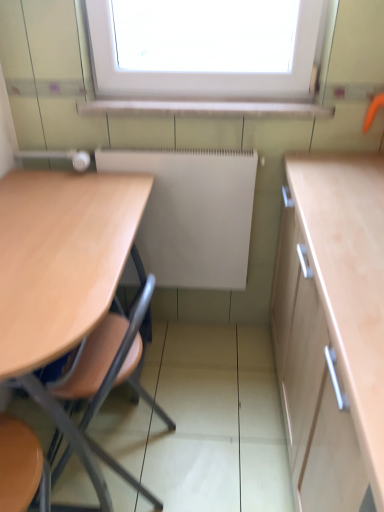
Question: From the image's perspective, would you say white matte radiator at center is positioned over light wood table at left?

Choices:
 (A) no
 (B) yes

Answer: (B)

Question: Is white matte radiator at center closer to camera compared to light wood table at left?

Choices:
 (A) yes
 (B) no

Answer: (B)

Question: Is white matte radiator at center positioned with its back to light wood table at left?

Choices:
 (A) no
 (B) yes

Answer: (A)

Question: Is white matte radiator at center next to light wood table at left and touching it?

Choices:
 (A) yes
 (B) no

Answer: (B)

Question: Is white matte radiator at center behind light wood table at left?

Choices:
 (A) no
 (B) yes

Answer: (B)

Question: Is white matte radiator at center taller than light wood table at left?

Choices:
 (A) no
 (B) yes

Answer: (A)

Question: From the image's perspective, is light wood table at left beneath white matte radiator at center?

Choices:
 (A) yes
 (B) no

Answer: (A)

Question: Is light wood table at left bigger than white matte radiator at center?

Choices:
 (A) yes
 (B) no

Answer: (A)

Question: Can you confirm if light wood table at left is wider than white matte radiator at center?

Choices:
 (A) yes
 (B) no

Answer: (A)

Question: Is light wood table at left thinner than white matte radiator at center?

Choices:
 (A) yes
 (B) no

Answer: (B)

Question: Would you say light wood table at left is outside white matte radiator at center?

Choices:
 (A) yes
 (B) no

Answer: (A)

Question: Is light wood table at left facing towards white matte radiator at center?

Choices:
 (A) no
 (B) yes

Answer: (A)

Question: From a real-world perspective, is white matte radiator at center above or below light wood table at left?

Choices:
 (A) above
 (B) below

Answer: (A)